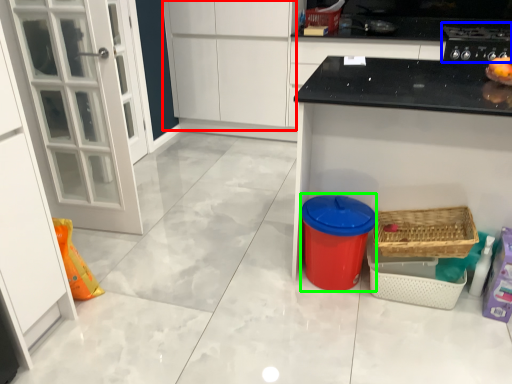
Question: Based on their relative distances, which object is farther from cabinetry (highlighted by a red box)? Choose from appliance (highlighted by a blue box) and appliance (highlighted by a green box).

Choices:
 (A) appliance
 (B) appliance

Answer: (B)